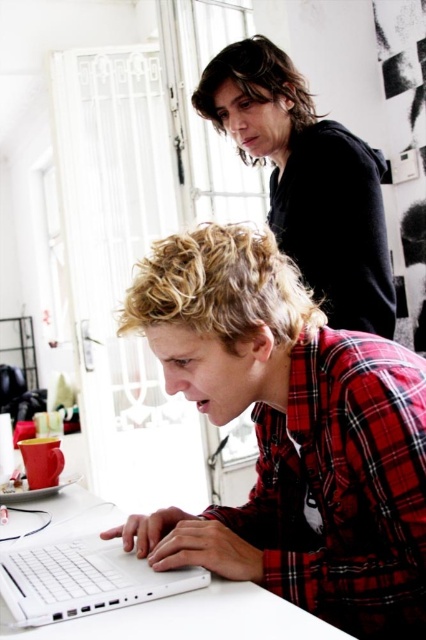
You are a delivery person standing 30 inches away from the camera. You need to hand a package to the person wearing the red plaid shirt at center. Can you reach them without moving closer?

The red plaid shirt at center is 27.77 inches away from the camera. Since you are 30 inches away from the camera, you are 2.23 inches behind the red plaid shirt at center. You can reach them without moving closer.

You are a delivery person who needs to place a small package on the white matte laptop at lower left. However, there is a black hoodie at upper center in the way. Can you place the package on the laptop without moving the hoodie?

The white matte laptop at lower left is behind the black hoodie at upper center, so you can place the package on the laptop without moving the hoodie because the laptop is already positioned behind the hoodie.

You are a delivery person who needs to place a small package on the desk without disturbing the red plaid shirt at center or the white matte laptop at lower left. Where should you place the package?

The package should be placed on the desk away from the red plaid shirt at center and the white matte laptop at lower left since the red plaid shirt at center is positioned over the laptop, leaving limited space around them for placement.